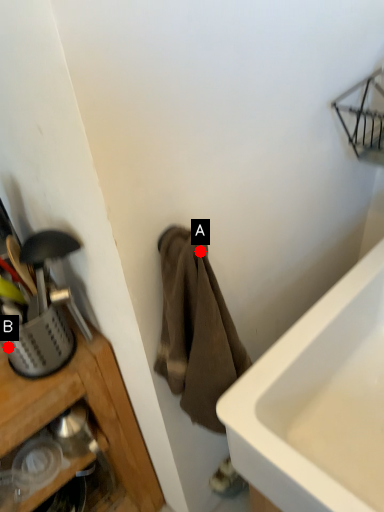
Question: Two points are circled on the image, labeled by A and B beside each circle. Which of the following is the farthest from the observer?

Choices:
 (A) A is further
 (B) B is further

Answer: (B)